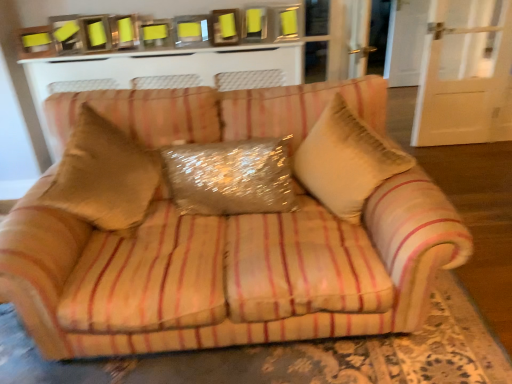
Question: Does sparkly metallic pillow at center have a smaller size compared to beige striped fabric couch at center?

Choices:
 (A) yes
 (B) no

Answer: (A)

Question: Is sparkly metallic pillow at center facing towards beige striped fabric couch at center?

Choices:
 (A) no
 (B) yes

Answer: (A)

Question: Can you confirm if sparkly metallic pillow at center is shorter than beige striped fabric couch at center?

Choices:
 (A) yes
 (B) no

Answer: (B)

Question: Is beige striped fabric couch at center inside sparkly metallic pillow at center?

Choices:
 (A) no
 (B) yes

Answer: (A)

Question: Is beige striped fabric couch at center at the back of sparkly metallic pillow at center?

Choices:
 (A) no
 (B) yes

Answer: (A)

Question: Is sparkly metallic pillow at center placed right next to beige striped fabric couch at center?

Choices:
 (A) no
 (B) yes

Answer: (A)

Question: From a real-world perspective, is sparkly metallic pillow at center physically below beige textured pillow at center?

Choices:
 (A) no
 (B) yes

Answer: (B)

Question: Does sparkly metallic pillow at center have a greater height compared to beige textured pillow at center?

Choices:
 (A) no
 (B) yes

Answer: (A)

Question: Is sparkly metallic pillow at center directly adjacent to beige textured pillow at center?

Choices:
 (A) yes
 (B) no

Answer: (B)

Question: Is sparkly metallic pillow at center thinner than beige textured pillow at center?

Choices:
 (A) yes
 (B) no

Answer: (A)

Question: Considering the relative sizes of sparkly metallic pillow at center and beige textured pillow at center in the image provided, is sparkly metallic pillow at center smaller than beige textured pillow at center?

Choices:
 (A) yes
 (B) no

Answer: (A)

Question: Could you tell me if sparkly metallic pillow at center is turned towards beige textured pillow at center?

Choices:
 (A) yes
 (B) no

Answer: (B)

Question: Does beige striped fabric couch at center appear on the right side of white textured cabinet at upper center?

Choices:
 (A) no
 (B) yes

Answer: (B)